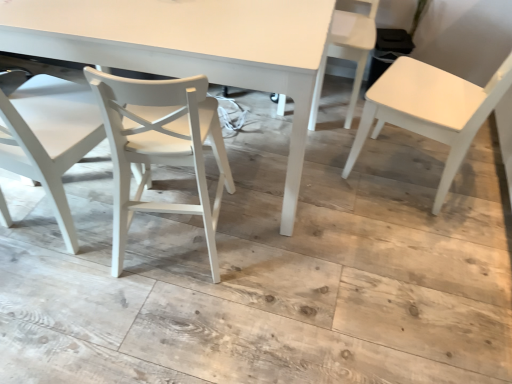
This screenshot has width=512, height=384. I want to click on vacant area that lies in front of white matte table at center, so click(199, 309).